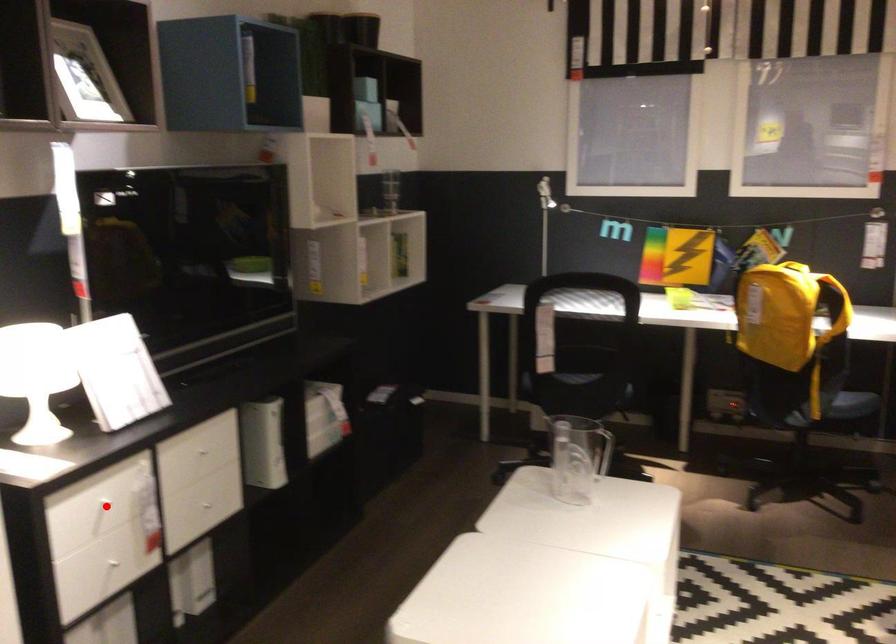
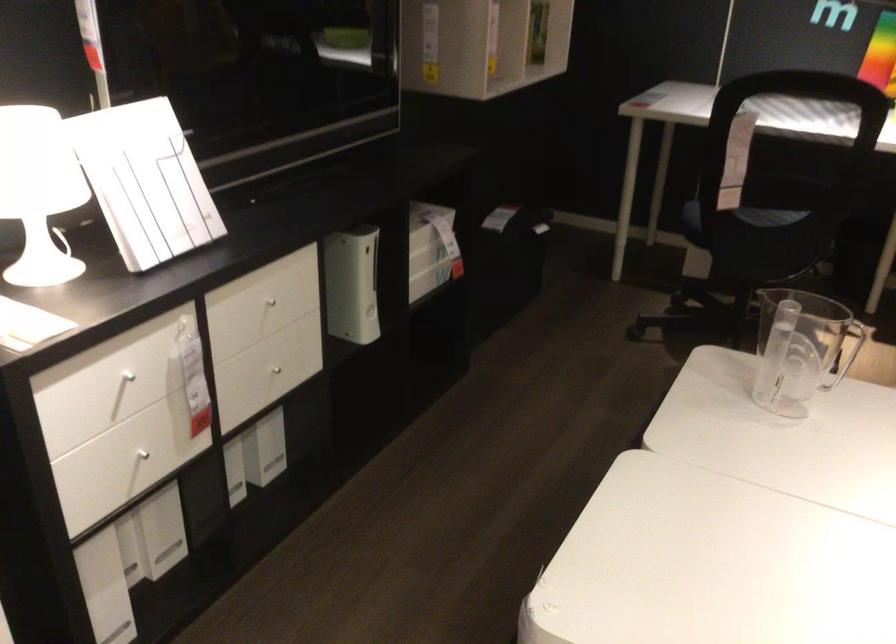
Find the pixel in the second image that matches the highlighted location in the first image.

(126, 377)